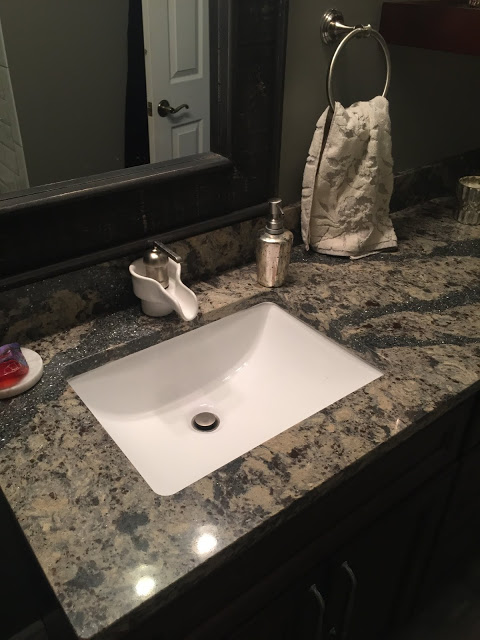
The width and height of the screenshot is (480, 640). Find the location of `mirror`. mirror is located at coordinates (76, 88).